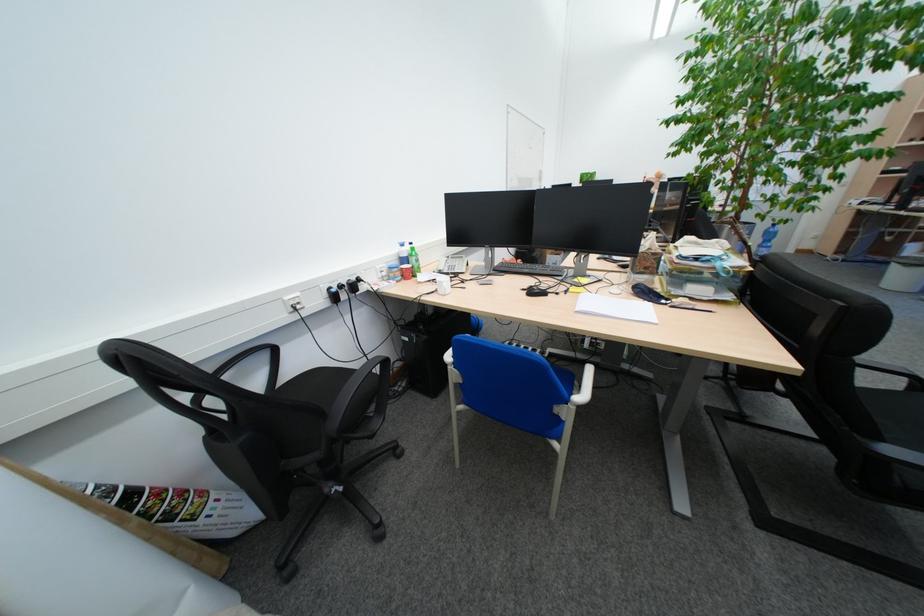
Where would you lift the white trash can? Please return your answer as a coordinate pair (x, y).

(906, 270)